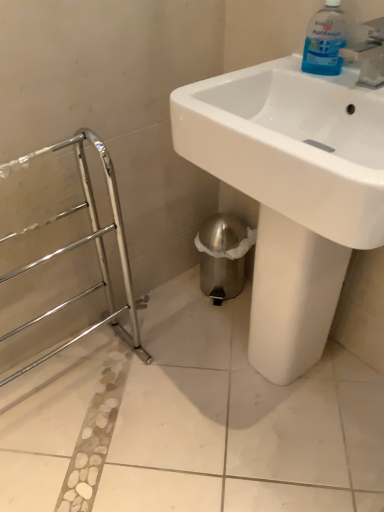
Question: In terms of size, does white glossy sink at center appear bigger or smaller than blue translucent plastic handwash at upper right?

Choices:
 (A) big
 (B) small

Answer: (A)

Question: Is white glossy sink at center wider or thinner than blue translucent plastic handwash at upper right?

Choices:
 (A) thin
 (B) wide

Answer: (B)

Question: In the image, is white glossy sink at center on the left side or the right side of blue translucent plastic handwash at upper right?

Choices:
 (A) right
 (B) left

Answer: (B)

Question: From a real-world perspective, is blue translucent plastic handwash at upper right above or below white glossy sink at center?

Choices:
 (A) above
 (B) below

Answer: (A)

Question: Considering the positions of point (336, 8) and point (360, 231), is point (336, 8) closer or farther from the camera than point (360, 231)?

Choices:
 (A) farther
 (B) closer

Answer: (A)

Question: From their relative heights in the image, would you say blue translucent plastic handwash at upper right is taller or shorter than white glossy sink at center?

Choices:
 (A) short
 (B) tall

Answer: (A)

Question: Considering their positions, is blue translucent plastic handwash at upper right located in front of or behind white glossy sink at center?

Choices:
 (A) behind
 (B) front

Answer: (A)